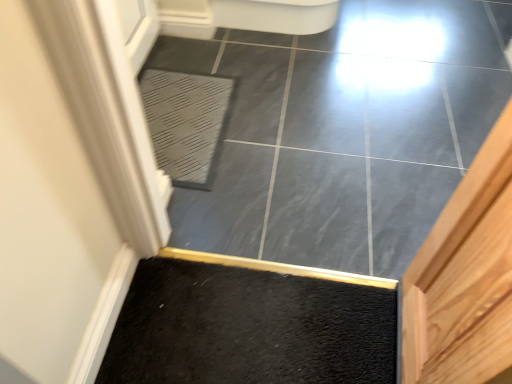
Image resolution: width=512 pixels, height=384 pixels. In order to click on free space above slate gray tile at center (from a real-world perspective) in this screenshot , I will do `click(317, 129)`.